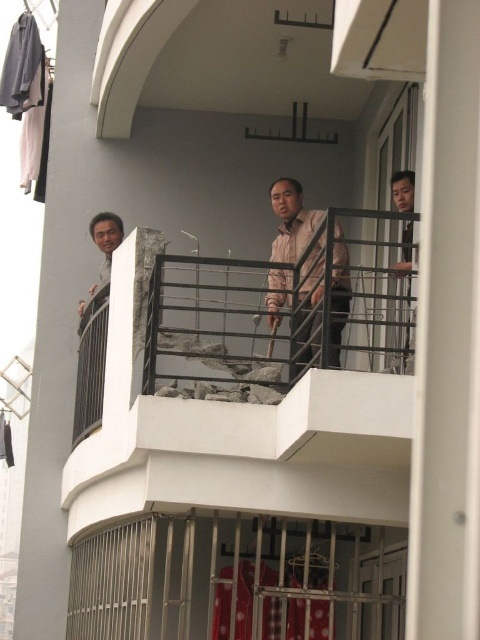
Looking at this image, which is more to the left, pink matte shirt at center or matte black shirt at upper right?

From the viewer's perspective, pink matte shirt at center appears more on the left side.

Can you confirm if pink matte shirt at center is smaller than matte black shirt at upper right?

No.

Describe the element at coordinates (291, 220) in the screenshot. I see `pink matte shirt at center` at that location.

This screenshot has height=640, width=480. Find the location of `pink matte shirt at center`. pink matte shirt at center is located at coordinates (291, 220).